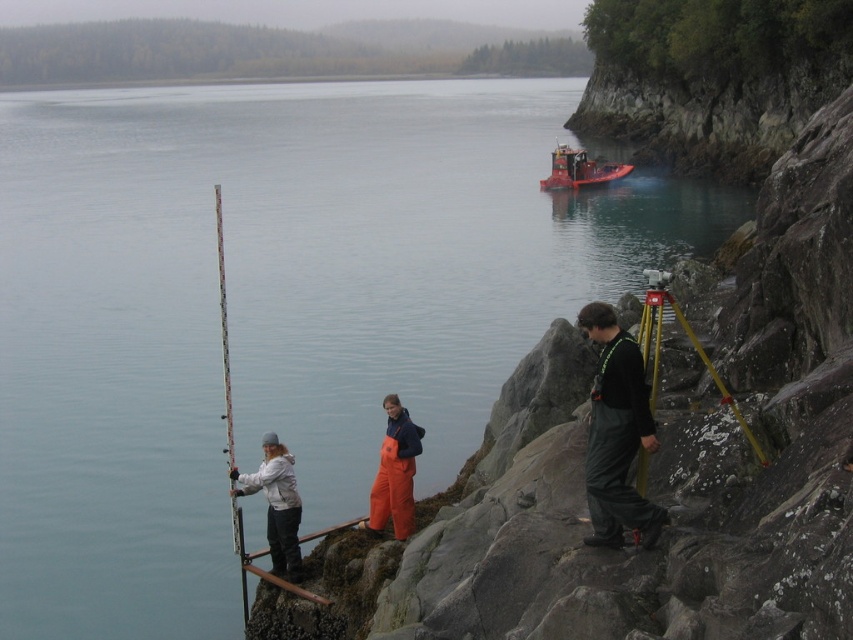
Question: Which object is positioned closest to the white fleece jacket at center?

Choices:
 (A) dark gray rubber boots at right
 (B) red rubber boat at center
 (C) orange waterproof overalls at center
 (D) white plastic fishing pole at left

Answer: (D)

Question: Based on their relative distances, which object is farther from the dark gray rubber boots at right?

Choices:
 (A) white fleece jacket at center
 (B) red rubber boat at center

Answer: (B)

Question: Is white fleece jacket at center positioned behind red rubber boat at center?

Choices:
 (A) no
 (B) yes

Answer: (A)

Question: Is orange waterproof overalls at center behind red rubber boat at center?

Choices:
 (A) no
 (B) yes

Answer: (A)

Question: Can you confirm if white fleece jacket at center is smaller than white plastic fishing pole at left?

Choices:
 (A) yes
 (B) no

Answer: (A)

Question: Which object is farther from the camera taking this photo?

Choices:
 (A) white plastic fishing pole at left
 (B) white fleece jacket at center
 (C) red rubber boat at center
 (D) dark gray rubber boots at right

Answer: (C)